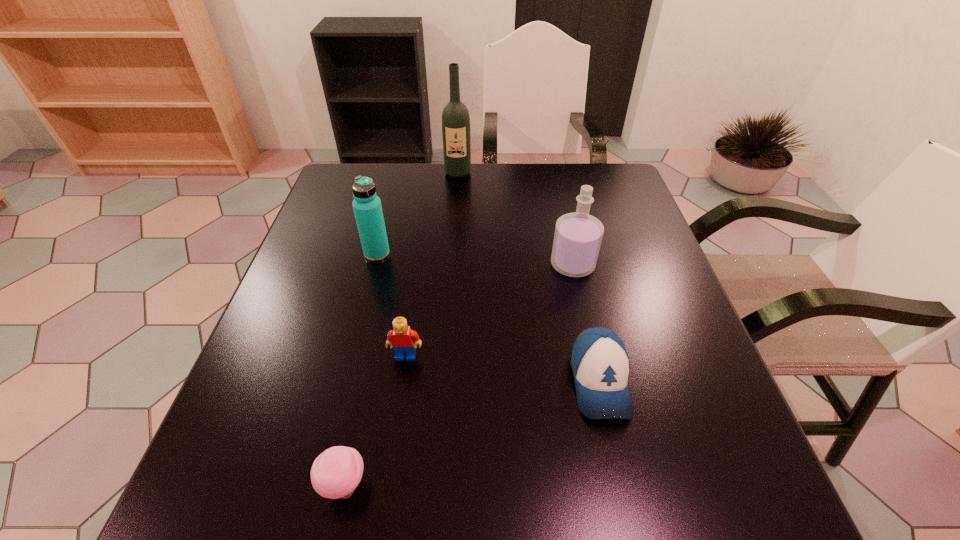
At what (x,y) coordinates should I click in order to perform the action: click on free point located 0.090m on the face of the third shortest object. Please return your answer as a coordinate pair (x, y). The width and height of the screenshot is (960, 540). Looking at the image, I should click on (399, 402).

Identify the location of free space located on the front-facing side of the baseball cap. Image resolution: width=960 pixels, height=540 pixels. (619, 468).

The image size is (960, 540). Find the location of `free space located 0.170m on the left of the nearest object`. free space located 0.170m on the left of the nearest object is located at coordinates (212, 487).

Find the location of a particular element. object that is at the far edge is located at coordinates (455, 117).

Where is `object that is at the near edge`? This screenshot has width=960, height=540. object that is at the near edge is located at coordinates (335, 473).

I want to click on object present at the left edge, so click(367, 208).

Find the location of `vacant space at the far edge`. vacant space at the far edge is located at coordinates (398, 166).

Locate an element on the screen. vacant space at the near edge of the desktop is located at coordinates (502, 476).

Locate an element on the screen. This screenshot has height=540, width=960. vacant region at the left edge of the desktop is located at coordinates (287, 345).

Where is `blank space at the right edge of the desktop`? The height and width of the screenshot is (540, 960). blank space at the right edge of the desktop is located at coordinates (664, 330).